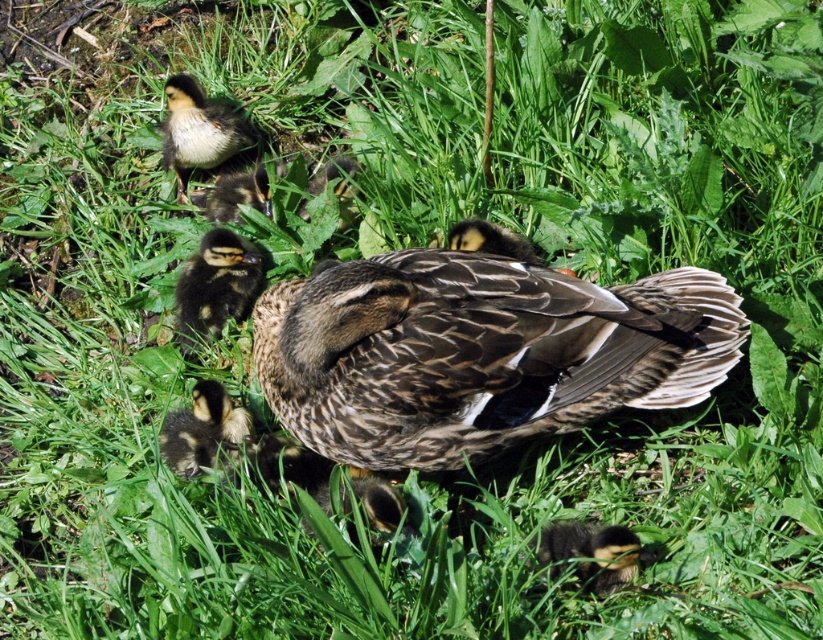
Is yellow downy duckling at upper left bigger than brown speckled duckling at upper center?

Yes.

What do you see at coordinates (198, 131) in the screenshot? I see `yellow downy duckling at upper left` at bounding box center [198, 131].

Between point (171, 145) and point (219, 205), which one is positioned behind?

The point (171, 145) is more distant.

Identify the location of yellow downy duckling at upper left. The image size is (823, 640). (198, 131).

Is yellow downy duckling at upper left behind speckled brown duckling at lower left?

Yes, yellow downy duckling at upper left is behind speckled brown duckling at lower left.

Is yellow downy duckling at upper left positioned before speckled brown duckling at lower left?

That is False.

Who is more distant from viewer, (x=175, y=90) or (x=249, y=417)?

Positioned behind is point (x=175, y=90).

The image size is (823, 640). What are the coordinates of `yellow downy duckling at upper left` in the screenshot? It's located at (198, 131).

Is speckled brown duckling at lower left positioned in front of dark brown fluffy duckling at lower right?

No, it is behind dark brown fluffy duckling at lower right.

Between speckled brown duckling at lower left and dark brown fluffy duckling at lower right, which one appears on the left side from the viewer's perspective?

Positioned to the left is speckled brown duckling at lower left.

Which is behind, point (212, 444) or point (542, 548)?

Positioned behind is point (212, 444).

Where is `speckled brown duckling at lower left`? This screenshot has width=823, height=640. speckled brown duckling at lower left is located at coordinates (203, 429).